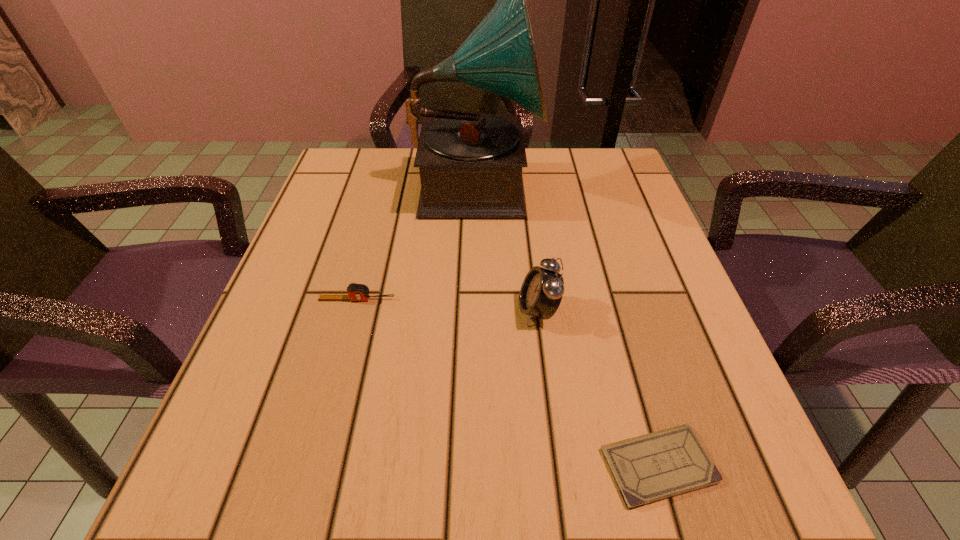
Locate an element on the screen. The image size is (960, 540). free region located on the front of the second shortest object is located at coordinates (305, 495).

At what (x,y) coordinates should I click in order to perform the action: click on free location located on the left of the nearest object. Please return your answer as a coordinate pair (x, y). Image resolution: width=960 pixels, height=540 pixels. Looking at the image, I should click on (565, 465).

The height and width of the screenshot is (540, 960). I want to click on object positioned at the far edge, so 470,164.

Locate an element on the screen. The width and height of the screenshot is (960, 540). object that is at the near edge is located at coordinates (648, 468).

Image resolution: width=960 pixels, height=540 pixels. I want to click on object positioned at the left edge, so click(356, 292).

The height and width of the screenshot is (540, 960). I want to click on object that is at the right edge, so click(x=648, y=468).

This screenshot has height=540, width=960. What are the coordinates of `object that is at the near right corner` in the screenshot? It's located at (648, 468).

Where is `free space at the far edge of the desktop`? This screenshot has width=960, height=540. free space at the far edge of the desktop is located at coordinates (398, 192).

Identify the location of vacant space at the left edge. This screenshot has height=540, width=960. (306, 245).

The image size is (960, 540). What are the coordinates of `vacant region at the right edge of the desktop` in the screenshot? It's located at (619, 376).